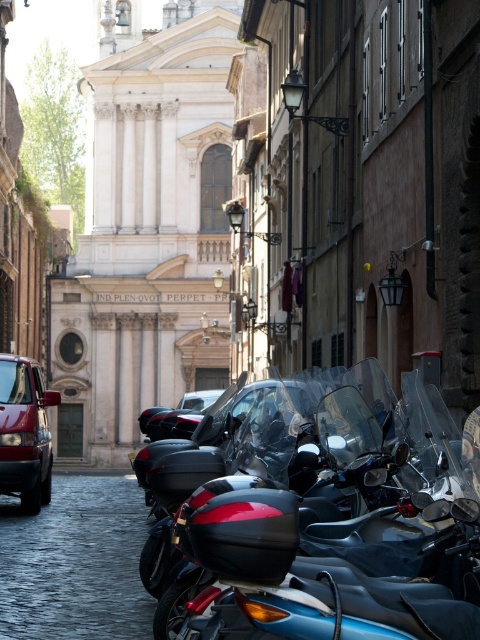
You are a tourist standing on the street and want to take a photo of the black glossy motorcycle at center and the matte red van at left. Which object is positioned higher in your field of view?

The black glossy motorcycle at center is positioned higher in the field of view than the matte red van at left, as it is located above it.

You are a delivery person who needs to park your motorcycle in the center of the street. The street has a black glossy motorcycle at center. Is there enough space to park your motorcycle without overlapping with the existing one?

The black glossy motorcycle at center is already parked at point (x=324, y=566), so there is no space to park another motorcycle in the center without overlapping.